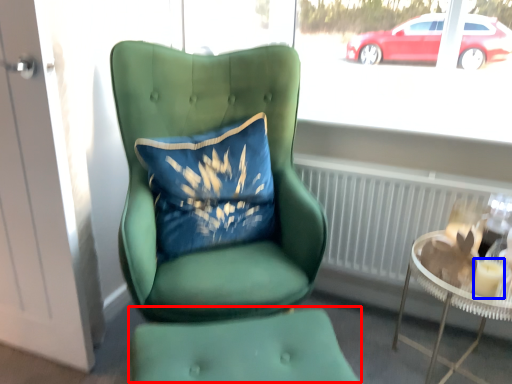
Question: Which of the following is the closest to the observer, footrest (highlighted by a red box) or candle holder (highlighted by a blue box)?

Choices:
 (A) footrest
 (B) candle holder

Answer: (A)